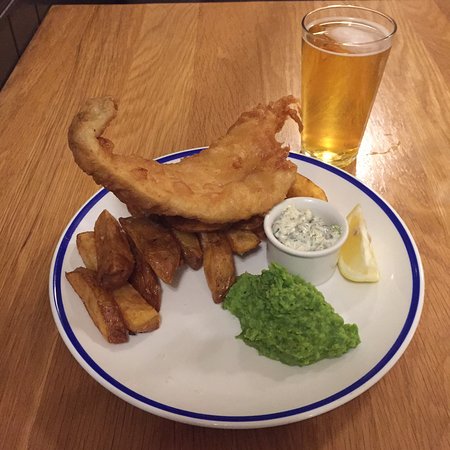
Find the location of `pint glass`. pint glass is located at coordinates (351, 48).